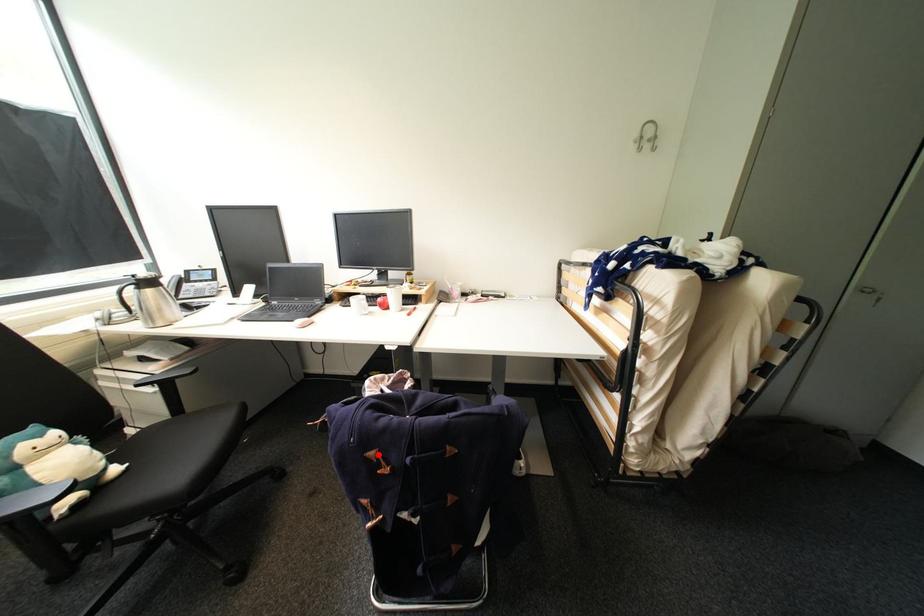
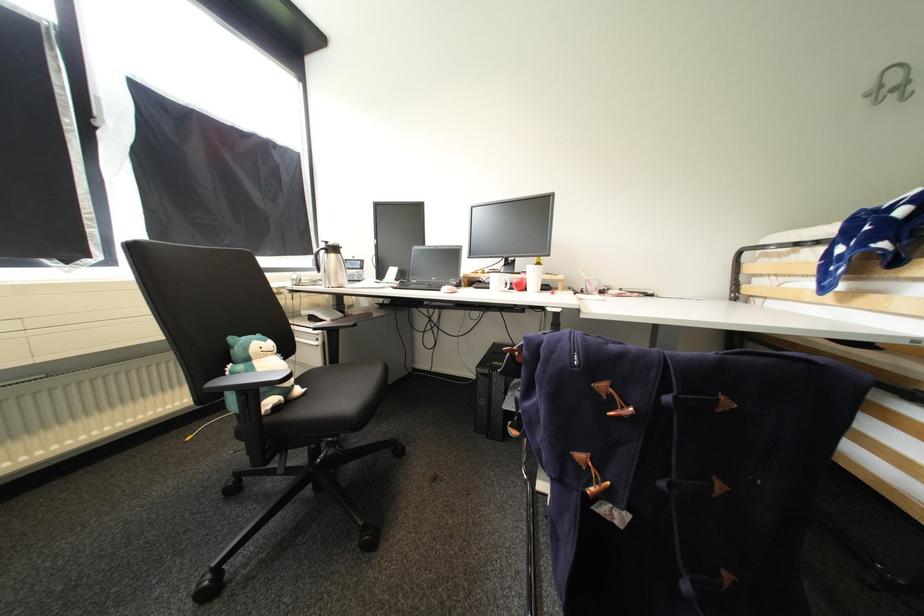
In the second image, find the point that corresponds to the highlighted location in the first image.

(610, 387)